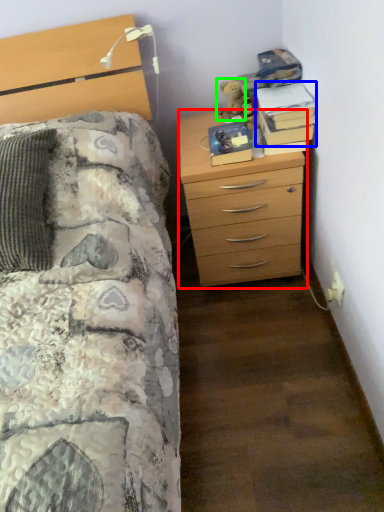
Question: Which object is the closest to the chest of drawers (highlighted by a red box)? Choose among these: book (highlighted by a blue box) or teddy (highlighted by a green box).

Choices:
 (A) book
 (B) teddy

Answer: (A)